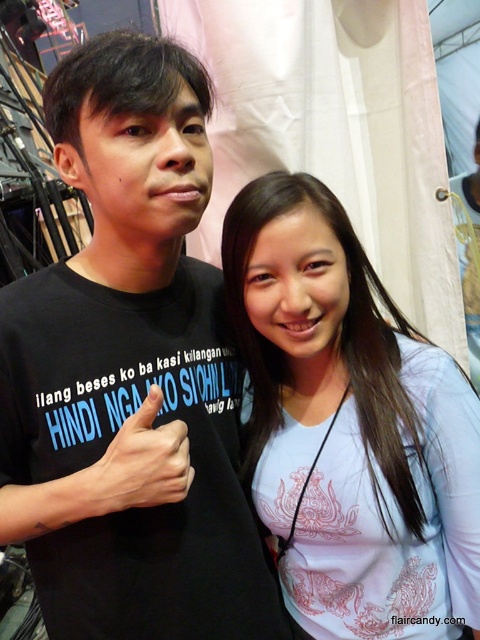
You are a photographer trying to adjust your camera focus. You notice two points in the image at coordinates point (382,540) and point (131,440). Which point should you focus on first if you want to prioritize the closer object?

You should focus on point (382,540) first because it is closer to the viewer compared to point (131,440).